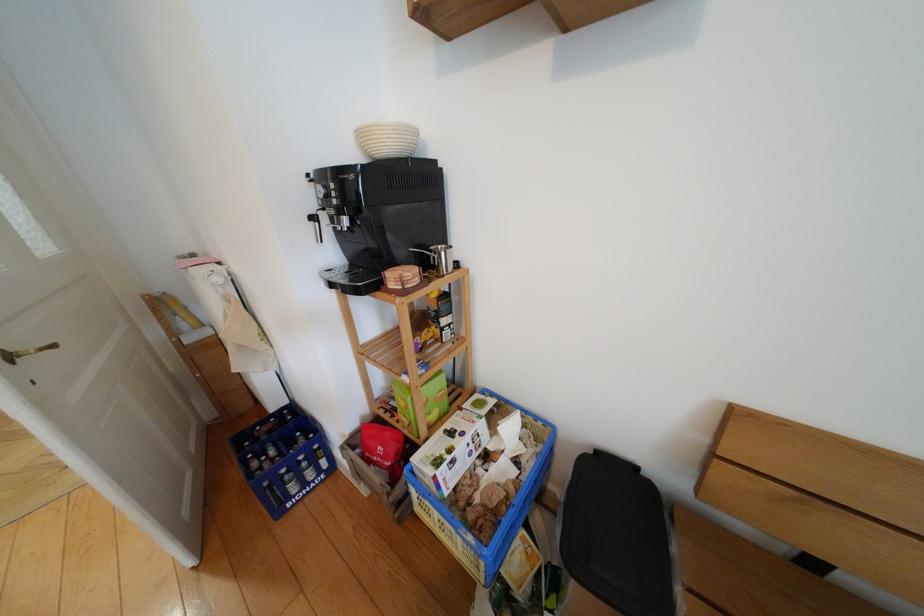
This screenshot has width=924, height=616. What are the coordinates of `brass door handle` in the screenshot? It's located at (25, 352).